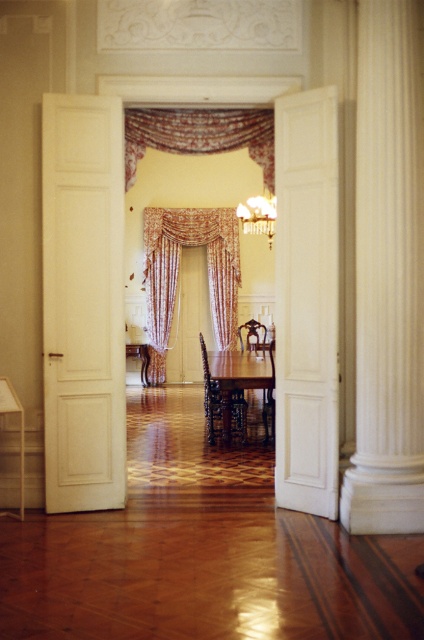
You are an interior designer assessing the space. You need to determine if the white marble column at center can be wrapped with the floral fabric curtain at center. Based on their sizes, is this feasible?

The white marble column at center is thinner than the floral fabric curtain at center, so the curtain is wider than the column. Therefore, wrapping the column with the curtain is feasible as the curtain can accommodate the column width.

Consider the image. You are standing in the doorway and see the floral fabric curtain at center and the mahogany wood chair at center. Which object is positioned higher relative to the other?

The floral fabric curtain at center is above the mahogany wood chair at center, so it is positioned higher.